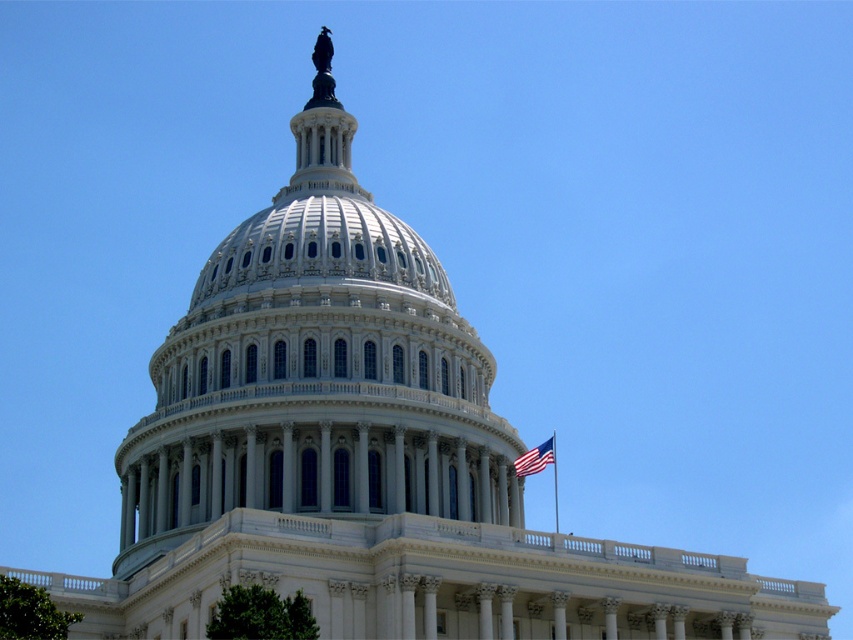
You are a tour guide explaining the Capitol building to visitors. You mention both the white marble dome at center and the white flagpole at upper center. Which of these two objects is taller?

The white marble dome at center is much taller than the white flagpole at upper center.

You are an architect analyzing the layout of the United States Capitol building. From your vantage point, which object is closer to you between the white marble dome at center and the white flagpole at upper center?

The white marble dome at center is closer to the viewer than the white flagpole at upper center.

You are standing at the base of the United States Capitol dome and see two points marked on the dome surface. The first point is at coordinates point (531,452) and the second is at point (552,438). Which of these points is closer to you?

Point (531,452) is in front of point (552,438), so it is closer to you.